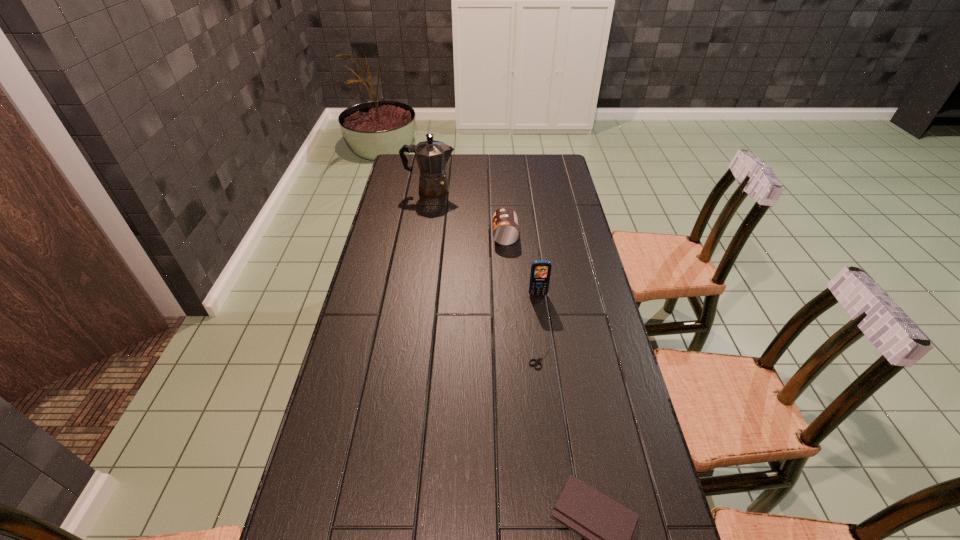
Identify the location of free space located 0.140m on the front label of the can. (455, 235).

Where is `free region located on the front label of the can`? free region located on the front label of the can is located at coordinates 468,235.

The width and height of the screenshot is (960, 540). I want to click on blank space located 0.330m on the front label of the can, so click(405, 235).

Find the location of a particular element. The width and height of the screenshot is (960, 540). free spot located 0.160m on the left of the second nearest object is located at coordinates (471, 357).

Locate an element on the screen. This screenshot has height=540, width=960. object that is at the left edge is located at coordinates (431, 156).

I want to click on vacant space at the far edge, so click(x=471, y=164).

In the image, there is a desktop. At what (x,y) coordinates should I click in order to perform the action: click on free region at the left edge. Please return your answer as a coordinate pair (x, y). The width and height of the screenshot is (960, 540). Looking at the image, I should click on (404, 277).

In order to click on free point at the right edge in this screenshot , I will do `click(555, 286)`.

I want to click on vacant space at the far left corner of the desktop, so click(405, 178).

The image size is (960, 540). In order to click on vacant space that's between the leftmost object and the shortest object in this screenshot , I will do `click(487, 273)`.